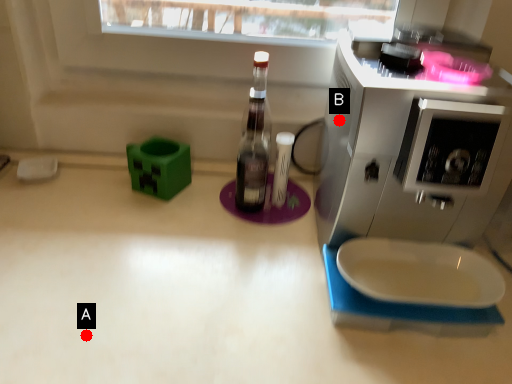
Question: Two points are circled on the image, labeled by A and B beside each circle. Which point appears farthest from the camera in this image?

Choices:
 (A) A is further
 (B) B is further

Answer: (B)